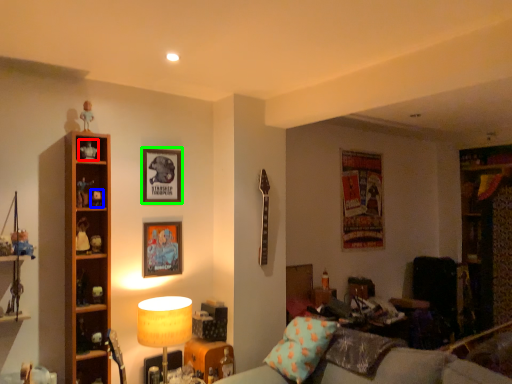
Question: Estimate the real-world distances between objects in this image. Which object is farther from toy (highlighted by a red box), toy (highlighted by a blue box) or picture frame (highlighted by a green box)?

Choices:
 (A) toy
 (B) picture frame

Answer: (B)